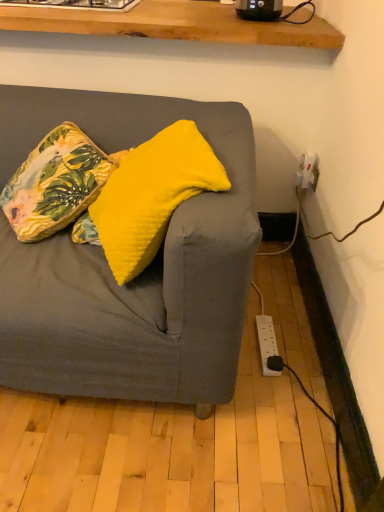
Measure the distance between point (111, 254) and camera.

Point (111, 254) is 3.35 feet from camera.

Describe the element at coordinates (152, 195) in the screenshot. I see `yellow soft cushion at center, arranged as the 1th pillow when viewed from the right` at that location.

Find the location of a particular element. The height and width of the screenshot is (512, 384). yellow soft cushion at center, arranged as the 1th pillow when viewed from the right is located at coordinates (152, 195).

What do you see at coordinates (56, 183) in the screenshot?
I see `floral fabric cushion at upper left, which is the second pillow in right-to-left order` at bounding box center [56, 183].

At what (x,y) coordinates should I click in order to perform the action: click on floral fabric cushion at upper left, which is the second pillow in right-to-left order. Please return your answer as a coordinate pair (x, y). Looking at the image, I should click on (56, 183).

Locate an element on the screen. yellow soft cushion at center, which is the 2th pillow in left-to-right order is located at coordinates (152, 195).

Can you confirm if yellow soft cushion at center, arranged as the 1th pillow when viewed from the right, is positioned to the right of floral fabric cushion at upper left, acting as the first pillow starting from the left?

Correct, you'll find yellow soft cushion at center, arranged as the 1th pillow when viewed from the right, to the right of floral fabric cushion at upper left, acting as the first pillow starting from the left.

Is yellow soft cushion at center, arranged as the 1th pillow when viewed from the right, positioned behind floral fabric cushion at upper left, acting as the first pillow starting from the left?

No, the depth of yellow soft cushion at center, arranged as the 1th pillow when viewed from the right, is less than that of floral fabric cushion at upper left, acting as the first pillow starting from the left.

Does point (135, 187) come behind point (94, 155)?

No, (135, 187) is in front of (94, 155).

From the image's perspective, which one is positioned lower, yellow soft cushion at center, arranged as the 1th pillow when viewed from the right, or floral fabric cushion at upper left, acting as the first pillow starting from the left?

yellow soft cushion at center, arranged as the 1th pillow when viewed from the right.

From a real-world perspective, does yellow soft cushion at center, which is the 2th pillow in left-to-right order, stand above floral fabric cushion at upper left, acting as the first pillow starting from the left?

Correct, in the physical world, yellow soft cushion at center, which is the 2th pillow in left-to-right order, is higher than floral fabric cushion at upper left, acting as the first pillow starting from the left.

Is yellow soft cushion at center, arranged as the 1th pillow when viewed from the right, wider or thinner than floral fabric cushion at upper left, which is the second pillow in right-to-left order?

yellow soft cushion at center, arranged as the 1th pillow when viewed from the right, is thinner than floral fabric cushion at upper left, which is the second pillow in right-to-left order.

Who is shorter, yellow soft cushion at center, which is the 2th pillow in left-to-right order, or floral fabric cushion at upper left, acting as the first pillow starting from the left?

Standing shorter between the two is floral fabric cushion at upper left, acting as the first pillow starting from the left.

Considering the relative sizes of yellow soft cushion at center, which is the 2th pillow in left-to-right order, and floral fabric cushion at upper left, acting as the first pillow starting from the left, in the image provided, is yellow soft cushion at center, which is the 2th pillow in left-to-right order, smaller than floral fabric cushion at upper left, acting as the first pillow starting from the left,?

No, yellow soft cushion at center, which is the 2th pillow in left-to-right order, is not smaller than floral fabric cushion at upper left, acting as the first pillow starting from the left.

Is yellow soft cushion at center, which is the 2th pillow in left-to-right order, inside the boundaries of floral fabric cushion at upper left, which is the second pillow in right-to-left order, or outside?

yellow soft cushion at center, which is the 2th pillow in left-to-right order, is not inside floral fabric cushion at upper left, which is the second pillow in right-to-left order, it's outside.

In the scene shown: Are yellow soft cushion at center, arranged as the 1th pillow when viewed from the right, and floral fabric cushion at upper left, acting as the first pillow starting from the left, located far from each other?

yellow soft cushion at center, arranged as the 1th pillow when viewed from the right, is actually quite close to floral fabric cushion at upper left, acting as the first pillow starting from the left.

Looking at this image, is yellow soft cushion at center, which is the 2th pillow in left-to-right order, looking in the opposite direction of floral fabric cushion at upper left, which is the second pillow in right-to-left order?

No, yellow soft cushion at center, which is the 2th pillow in left-to-right order, is not facing the opposite direction of floral fabric cushion at upper left, which is the second pillow in right-to-left order.

Measure the distance from yellow soft cushion at center, which is the 2th pillow in left-to-right order, to floral fabric cushion at upper left, which is the second pillow in right-to-left order.

They are 23.70 centimeters apart.

The image size is (384, 512). Identify the location of pillow below the yellow soft cushion at center, arranged as the 1th pillow when viewed from the right (from a real-world perspective). (56, 183).

Which is more to the right, floral fabric cushion at upper left, acting as the first pillow starting from the left, or yellow soft cushion at center, arranged as the 1th pillow when viewed from the right?

yellow soft cushion at center, arranged as the 1th pillow when viewed from the right.

Considering the positions of objects floral fabric cushion at upper left, which is the second pillow in right-to-left order, and yellow soft cushion at center, which is the 2th pillow in left-to-right order, in the image provided, who is behind, floral fabric cushion at upper left, which is the second pillow in right-to-left order, or yellow soft cushion at center, which is the 2th pillow in left-to-right order,?

floral fabric cushion at upper left, which is the second pillow in right-to-left order, is behind.

Considering the positions of points (38, 218) and (116, 249), is point (38, 218) closer to camera compared to point (116, 249)?

No, it is behind (116, 249).

From the image's perspective, between floral fabric cushion at upper left, which is the second pillow in right-to-left order, and yellow soft cushion at center, arranged as the 1th pillow when viewed from the right, who is located below?

yellow soft cushion at center, arranged as the 1th pillow when viewed from the right, is shown below in the image.

From a real-world perspective, is floral fabric cushion at upper left, acting as the first pillow starting from the left, below yellow soft cushion at center, which is the 2th pillow in left-to-right order?

Yes.

Considering the relative sizes of floral fabric cushion at upper left, acting as the first pillow starting from the left, and yellow soft cushion at center, which is the 2th pillow in left-to-right order, in the image provided, is floral fabric cushion at upper left, acting as the first pillow starting from the left, wider than yellow soft cushion at center, which is the 2th pillow in left-to-right order,?

Indeed, floral fabric cushion at upper left, acting as the first pillow starting from the left, has a greater width compared to yellow soft cushion at center, which is the 2th pillow in left-to-right order.

Considering the relative sizes of floral fabric cushion at upper left, which is the second pillow in right-to-left order, and yellow soft cushion at center, which is the 2th pillow in left-to-right order, in the image provided, is floral fabric cushion at upper left, which is the second pillow in right-to-left order, taller than yellow soft cushion at center, which is the 2th pillow in left-to-right order,?

No, floral fabric cushion at upper left, which is the second pillow in right-to-left order, is not taller than yellow soft cushion at center, which is the 2th pillow in left-to-right order.

Looking at the image, does floral fabric cushion at upper left, which is the second pillow in right-to-left order, seem bigger or smaller compared to yellow soft cushion at center, arranged as the 1th pillow when viewed from the right?

floral fabric cushion at upper left, which is the second pillow in right-to-left order, is smaller than yellow soft cushion at center, arranged as the 1th pillow when viewed from the right.

Would you say floral fabric cushion at upper left, acting as the first pillow starting from the left, contains yellow soft cushion at center, arranged as the 1th pillow when viewed from the right?

No, yellow soft cushion at center, arranged as the 1th pillow when viewed from the right, is not a part of floral fabric cushion at upper left, acting as the first pillow starting from the left.

Is the surface of floral fabric cushion at upper left, acting as the first pillow starting from the left, in direct contact with yellow soft cushion at center, which is the 2th pillow in left-to-right order?

No, floral fabric cushion at upper left, acting as the first pillow starting from the left, is not with yellow soft cushion at center, which is the 2th pillow in left-to-right order.

Could you tell me if floral fabric cushion at upper left, which is the second pillow in right-to-left order, is facing yellow soft cushion at center, arranged as the 1th pillow when viewed from the right?

No, floral fabric cushion at upper left, which is the second pillow in right-to-left order, is not oriented towards yellow soft cushion at center, arranged as the 1th pillow when viewed from the right.

Locate an element on the screen. pillow that is above the yellow soft cushion at center, which is the 2th pillow in left-to-right order (from the image's perspective) is located at coordinates (56, 183).

I want to click on pillow that is under the yellow soft cushion at center, arranged as the 1th pillow when viewed from the right (from a real-world perspective), so click(x=56, y=183).

Locate an element on the screen. Image resolution: width=384 pixels, height=512 pixels. pillow that appears in front of the floral fabric cushion at upper left, which is the second pillow in right-to-left order is located at coordinates (152, 195).